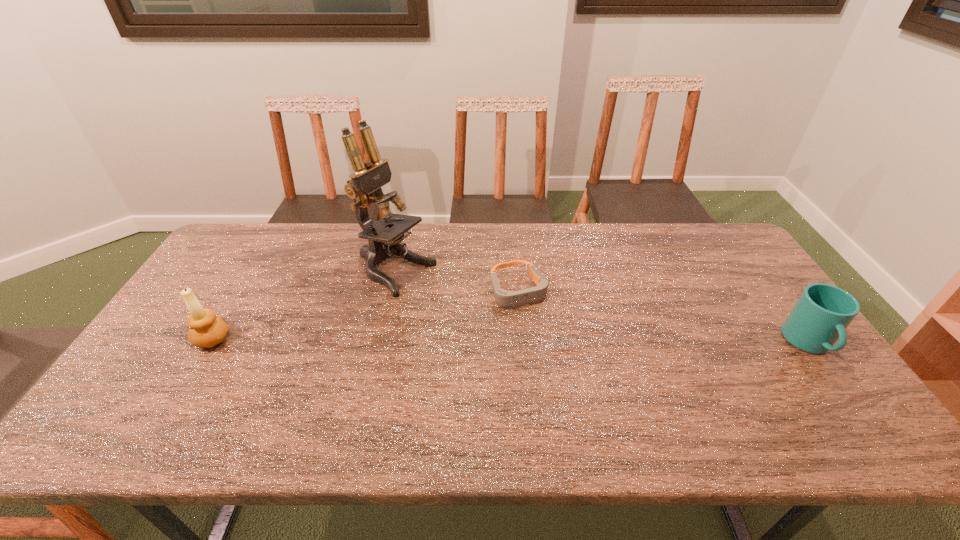
Identify the location of the leftmost object. (206, 330).

Where is `the third shortest object`? The height and width of the screenshot is (540, 960). the third shortest object is located at coordinates (206, 330).

Locate an element on the screen. The image size is (960, 540). the third tallest object is located at coordinates (820, 317).

Locate an element on the screen. This screenshot has height=540, width=960. the rightmost object is located at coordinates (820, 317).

What are the coordinates of `goggles` in the screenshot? It's located at (509, 299).

Where is `the shortest object`? This screenshot has height=540, width=960. the shortest object is located at coordinates (509, 299).

You are a GUI agent. You are given a task and a screenshot of the screen. Output one action in this format:
    pyautogui.click(x=<x>, y=<y>)
    Task: Click on the tallest object
    
    Given the screenshot: What is the action you would take?
    pyautogui.click(x=364, y=186)

The height and width of the screenshot is (540, 960). Identify the location of the second object from left to right. (364, 186).

Locate an element on the screen. This screenshot has width=960, height=540. free space located on the right of the leftmost object is located at coordinates (330, 339).

This screenshot has width=960, height=540. In order to click on vacant space located 0.080m on the handle side of the second shortest object in this screenshot , I will do (x=846, y=395).